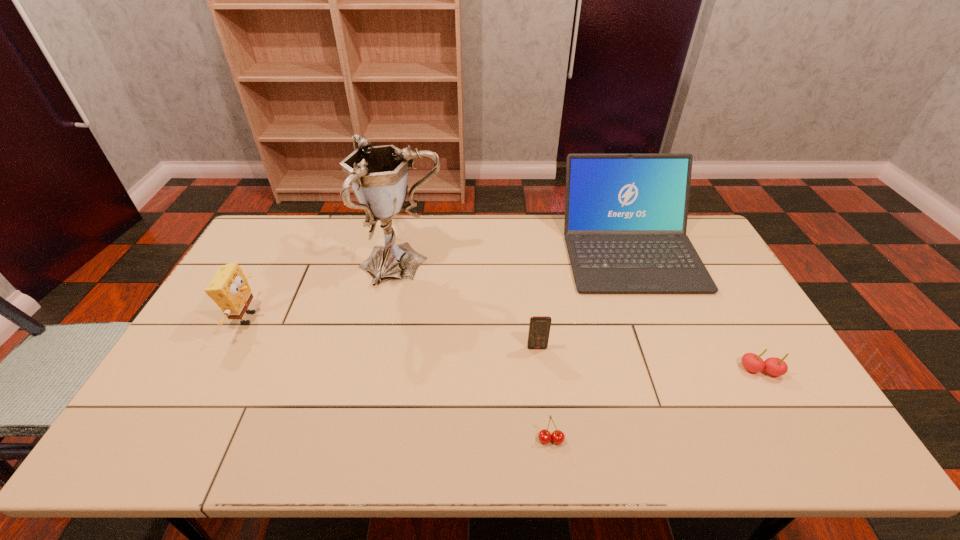
The image size is (960, 540). Find the location of `cherry at the right edge`. cherry at the right edge is located at coordinates (754, 363).

The height and width of the screenshot is (540, 960). I want to click on object present at the far right corner, so click(625, 225).

I want to click on vacant space at the far edge of the desktop, so click(324, 224).

In the image, there is a desktop. What are the coordinates of `free space at the near edge` in the screenshot? It's located at (209, 455).

This screenshot has width=960, height=540. In the image, there is a desktop. What are the coordinates of `vacant space at the left edge` in the screenshot? It's located at (277, 264).

Where is `vacant space at the right edge of the desktop`? The height and width of the screenshot is (540, 960). vacant space at the right edge of the desktop is located at coordinates (746, 393).

The image size is (960, 540). Identify the location of free point at the far right corner. (696, 225).

The image size is (960, 540). Find the location of `vacant area that lies between the tallest object and the cellular telephone`. vacant area that lies between the tallest object and the cellular telephone is located at coordinates (469, 306).

You are a GUI agent. You are given a task and a screenshot of the screen. Output one action in this format:
    pyautogui.click(x=<x>, y=<y>)
    Task: Click on the vacant area between the fifth farthest object and the leftmost object
    
    Given the screenshot: What is the action you would take?
    pyautogui.click(x=504, y=344)

The image size is (960, 540). I want to click on vacant space that is in between the fifth farthest object and the fourth tallest object, so click(x=649, y=359).